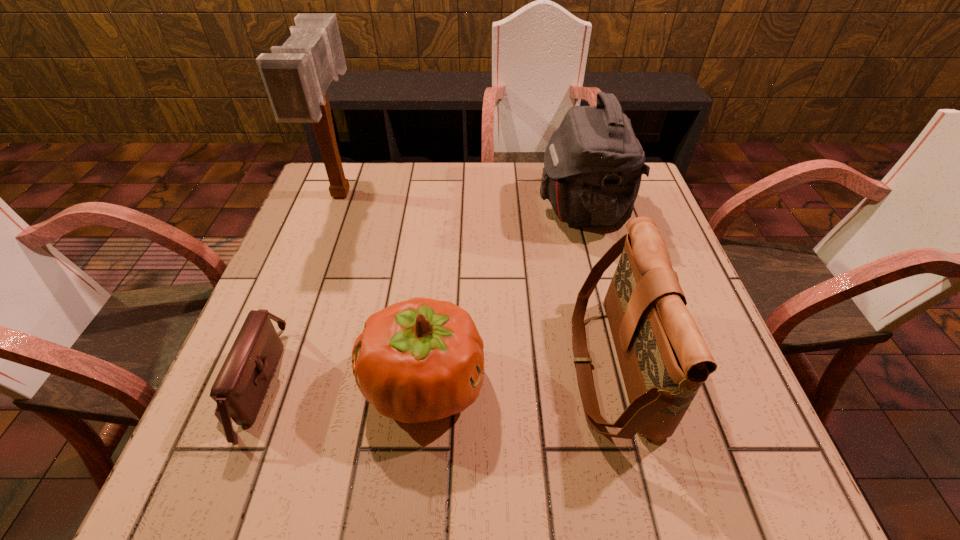
Identify the location of mallet that is positioned at the left edge. (296, 75).

Image resolution: width=960 pixels, height=540 pixels. I want to click on shoulder bag present at the left edge, so click(239, 390).

Image resolution: width=960 pixels, height=540 pixels. What are the coordinates of `object that is at the far left corner` in the screenshot? It's located at (296, 75).

I want to click on object that is at the near left corner, so click(239, 390).

Where is `object positioned at the far right corner`? object positioned at the far right corner is located at coordinates (593, 164).

Where is `object that is at the near right corner`? The image size is (960, 540). object that is at the near right corner is located at coordinates (664, 360).

This screenshot has width=960, height=540. What are the coordinates of `vacant region at the far edge of the desktop` in the screenshot? It's located at (480, 186).

This screenshot has width=960, height=540. I want to click on vacant space at the left edge of the desktop, so click(276, 407).

Find the location of a particular element. This screenshot has width=960, height=540. vacant space at the right edge is located at coordinates (694, 410).

Where is `free spot between the third object from left to right and the tallest object`? This screenshot has width=960, height=540. free spot between the third object from left to right and the tallest object is located at coordinates (383, 288).